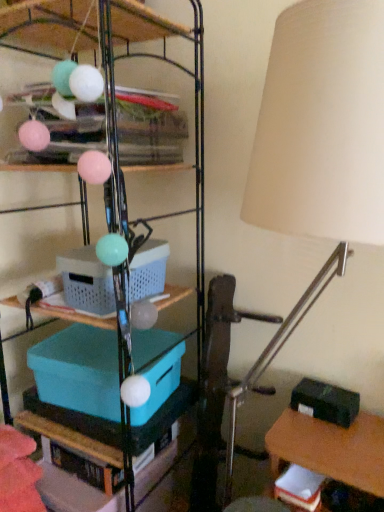
What do you see at coordinates (86, 282) in the screenshot? This screenshot has width=384, height=512. I see `plastic basket at center, acting as the first storage box starting from the top` at bounding box center [86, 282].

I want to click on teal plastic storage box at center-left, positioned as the second storage box in top-to-bottom order, so click(78, 371).

Image resolution: width=384 pixels, height=512 pixels. What do you see at coordinates (51, 24) in the screenshot? I see `metallic wire shelving at upper center, positioned as the second shelf in bottom-to-top order` at bounding box center [51, 24].

At what (x,y) coordinates should I click in order to perform the action: click on beige fabric lampshade at right. Please return your answer as a coordinate pair (x, y). Looking at the image, I should click on (318, 145).

From the image's perspective, which is below, teal plastic storage box at center-left, positioned as the second storage box in top-to-bottom order, or beige fabric lampshade at right?

teal plastic storage box at center-left, positioned as the second storage box in top-to-bottom order, is shown below in the image.

Is point (165, 331) more distant than point (286, 164)?

Yes, it is.

Could beige fabric lampshade at right be considered to be inside teal plastic storage box at center-left, which ranks as the third storage box in right-to-left order?

No, beige fabric lampshade at right is not inside teal plastic storage box at center-left, which ranks as the third storage box in right-to-left order.

Consider the image. From a real-world perspective, which object stands above the other?

beige fabric lampshade at right.

Is plastic basket at center, which appears as the 2th storage box when viewed from the left, in contact with metallic wire shelving at upper center, marked as the 1th shelf in a top-to-bottom arrangement?

No, plastic basket at center, which appears as the 2th storage box when viewed from the left, is not touching metallic wire shelving at upper center, marked as the 1th shelf in a top-to-bottom arrangement.

Based on the photo, relative to metallic wire shelving at upper center, positioned as the second shelf in bottom-to-top order, is plastic basket at center, placed as the 2th storage box when sorted from right to left, in front or behind?

In the image, plastic basket at center, placed as the 2th storage box when sorted from right to left, appears behind metallic wire shelving at upper center, positioned as the second shelf in bottom-to-top order.

From a real-world perspective, is plastic basket at center, arranged as the 3th storage box when ordered from the bottom, on metallic wire shelving at upper center, positioned as the second shelf in bottom-to-top order?

No.

Who is bigger, plastic basket at center, acting as the first storage box starting from the top, or metallic wire shelving at upper center, marked as the 1th shelf in a top-to-bottom arrangement?

Bigger between the two is metallic wire shelving at upper center, marked as the 1th shelf in a top-to-bottom arrangement.

Choose the correct answer: Is plastic basket at center, which appears as the 2th storage box when viewed from the left, inside teal plastic storage box at center-left, positioned as the second storage box in top-to-bottom order, or outside it?

plastic basket at center, which appears as the 2th storage box when viewed from the left, is not enclosed by teal plastic storage box at center-left, positioned as the second storage box in top-to-bottom order.

In the scene shown: Can you confirm if plastic basket at center, arranged as the 3th storage box when ordered from the bottom, is smaller than teal plastic storage box at center-left, which ranks as the second storage box in bottom-to-top order?

Yes.

From the image's perspective, is plastic basket at center, arranged as the 3th storage box when ordered from the bottom, under teal plastic storage box at center-left, which ranks as the third storage box in right-to-left order?

Incorrect, from the image's perspective, plastic basket at center, arranged as the 3th storage box when ordered from the bottom, is higher than teal plastic storage box at center-left, which ranks as the third storage box in right-to-left order.

Which of these two, plastic basket at center, acting as the first storage box starting from the top, or teal plastic storage box at center-left, which ranks as the third storage box in right-to-left order, is thinner?

plastic basket at center, acting as the first storage box starting from the top.

Between teal plastic storage bin at center, which is counted as the 2th shelf, starting from the top, and plastic basket at center, which appears as the 2th storage box when viewed from the left, which one has smaller size?

With smaller size is plastic basket at center, which appears as the 2th storage box when viewed from the left.

Which is correct: teal plastic storage bin at center, marked as the 1th shelf in a bottom-to-top arrangement, is inside plastic basket at center, arranged as the 3th storage box when ordered from the bottom, or outside of it?

teal plastic storage bin at center, marked as the 1th shelf in a bottom-to-top arrangement, is not inside plastic basket at center, arranged as the 3th storage box when ordered from the bottom, it's outside.

From the image's perspective, who appears lower, teal plastic storage bin at center, marked as the 1th shelf in a bottom-to-top arrangement, or plastic basket at center, which appears as the 2th storage box when viewed from the left?

From the image's view, teal plastic storage bin at center, marked as the 1th shelf in a bottom-to-top arrangement, is below.

Considering the relative sizes of teal plastic storage bin at center, which is counted as the 2th shelf, starting from the top, and plastic basket at center, arranged as the 3th storage box when ordered from the bottom, in the image provided, is teal plastic storage bin at center, which is counted as the 2th shelf, starting from the top, thinner than plastic basket at center, arranged as the 3th storage box when ordered from the bottom,?

No.

Can you confirm if teal plastic storage bin at center, which is counted as the 2th shelf, starting from the top, is positioned to the right of black matte storage box at lower right, the 3th storage box from the left?

Incorrect, teal plastic storage bin at center, which is counted as the 2th shelf, starting from the top, is not on the right side of black matte storage box at lower right, the 3th storage box from the left.

From a real-world perspective, is teal plastic storage bin at center, marked as the 1th shelf in a bottom-to-top arrangement, on top of black matte storage box at lower right, marked as the 1th storage box in a right-to-left arrangement?

Indeed, from a real-world perspective, teal plastic storage bin at center, marked as the 1th shelf in a bottom-to-top arrangement, stands above black matte storage box at lower right, marked as the 1th storage box in a right-to-left arrangement.

From the image's perspective, is teal plastic storage bin at center, marked as the 1th shelf in a bottom-to-top arrangement, above black matte storage box at lower right, positioned as the first storage box in bottom-to-top order?

Yes, from the image's perspective, teal plastic storage bin at center, marked as the 1th shelf in a bottom-to-top arrangement, is on top of black matte storage box at lower right, positioned as the first storage box in bottom-to-top order.

Is black matte storage box at lower right, positioned as the first storage box in bottom-to-top order, closer to camera compared to teal plastic storage bin at center, marked as the 1th shelf in a bottom-to-top arrangement?

No, black matte storage box at lower right, positioned as the first storage box in bottom-to-top order, is further to the viewer.

Is black matte storage box at lower right, marked as the 1th storage box in a right-to-left arrangement, directly adjacent to teal plastic storage bin at center, marked as the 1th shelf in a bottom-to-top arrangement?

black matte storage box at lower right, marked as the 1th storage box in a right-to-left arrangement, and teal plastic storage bin at center, marked as the 1th shelf in a bottom-to-top arrangement, are not in contact.

Would you say teal plastic storage bin at center, which is counted as the 2th shelf, starting from the top, is part of black matte storage box at lower right, the 3th storage box from the left,'s contents?

No, teal plastic storage bin at center, which is counted as the 2th shelf, starting from the top, is not surrounded by black matte storage box at lower right, the 3th storage box from the left.

Based on the photo, is plastic basket at center, which appears as the 2th storage box when viewed from the left, located outside beige fabric lampshade at right?

Yes.

Locate an element on the screen. the 1st storage box behind the beige fabric lampshade at right, counting from the anchor's position is located at coordinates click(x=86, y=282).

Is plastic basket at center, which appears as the 2th storage box when viewed from the left, looking in the opposite direction of beige fabric lampshade at right?

That's not correct — plastic basket at center, which appears as the 2th storage box when viewed from the left, is not looking away from beige fabric lampshade at right.

From the image's perspective, between plastic basket at center, arranged as the 3th storage box when ordered from the bottom, and beige fabric lampshade at right, which one is located above?

plastic basket at center, arranged as the 3th storage box when ordered from the bottom, from the image's perspective.

What are the coordinates of `the 2nd storage box to the left of the beige fabric lampshade at right, counting from the anchor's position` in the screenshot? It's located at (78, 371).

This screenshot has width=384, height=512. In order to click on shelf that is the 1st one when counting forward from the plastic basket at center, acting as the first storage box starting from the top in this screenshot , I will do `click(51, 24)`.

Estimate the real-world distances between objects in this image. Which object is closer to plastic basket at center, placed as the 2th storage box when sorted from right to left, beige fabric lampshade at right or black matte storage box at lower right, marked as the 1th storage box in a right-to-left arrangement?

Based on the image, beige fabric lampshade at right appears to be nearer to plastic basket at center, placed as the 2th storage box when sorted from right to left.

Based on their spatial positions, is teal plastic storage box at center-left, which ranks as the second storage box in bottom-to-top order, or beige fabric lampshade at right further from teal plastic storage bin at center, which is counted as the 2th shelf, starting from the top?

beige fabric lampshade at right lies further to teal plastic storage bin at center, which is counted as the 2th shelf, starting from the top, than the other object.

Which object lies further to the anchor point metallic wire shelving at upper center, marked as the 1th shelf in a top-to-bottom arrangement, plastic basket at center, arranged as the 3th storage box when ordered from the bottom, or black matte storage box at lower right, positioned as the first storage box in bottom-to-top order?

black matte storage box at lower right, positioned as the first storage box in bottom-to-top order, is positioned further to the anchor metallic wire shelving at upper center, marked as the 1th shelf in a top-to-bottom arrangement.

Considering their positions, is black matte storage box at lower right, the 3th storage box from the left, positioned further to teal plastic storage box at center-left, positioned as the second storage box in top-to-bottom order, than beige fabric lampshade at right?

beige fabric lampshade at right is further to teal plastic storage box at center-left, positioned as the second storage box in top-to-bottom order.

From the image, which object appears to be farther from teal plastic storage bin at center, which is counted as the 2th shelf, starting from the top, metallic wire shelving at upper center, marked as the 1th shelf in a top-to-bottom arrangement, or teal plastic storage box at center-left, positioned as the second storage box in top-to-bottom order?

Among the two, teal plastic storage box at center-left, positioned as the second storage box in top-to-bottom order, is located further to teal plastic storage bin at center, which is counted as the 2th shelf, starting from the top.

Estimate the real-world distances between objects in this image. Which object is further from teal plastic storage bin at center, which is counted as the 2th shelf, starting from the top, black matte storage box at lower right, which is counted as the third storage box, starting from the top, or metallic wire shelving at upper center, marked as the 1th shelf in a top-to-bottom arrangement?

Result: black matte storage box at lower right, which is counted as the third storage box, starting from the top.

Considering their positions, is teal plastic storage box at center-left, acting as the first storage box starting from the left, positioned closer to black matte storage box at lower right, which is counted as the third storage box, starting from the top, than beige fabric lampshade at right?

teal plastic storage box at center-left, acting as the first storage box starting from the left, lies closer to black matte storage box at lower right, which is counted as the third storage box, starting from the top, than the other object.

Based on the photo, looking at the image, which one is located further to teal plastic storage box at center-left, which ranks as the second storage box in bottom-to-top order, metallic wire shelving at upper center, marked as the 1th shelf in a top-to-bottom arrangement, or black matte storage box at lower right, which is counted as the third storage box, starting from the top?

metallic wire shelving at upper center, marked as the 1th shelf in a top-to-bottom arrangement, is further to teal plastic storage box at center-left, which ranks as the second storage box in bottom-to-top order.

At what (x,y) coordinates should I click in order to perform the action: click on storage box between teal plastic storage box at center-left, which ranks as the third storage box in right-to-left order, and black matte storage box at lower right, positioned as the first storage box in bottom-to-top order, in the horizontal direction. Please return your answer as a coordinate pair (x, y). Looking at the image, I should click on (86, 282).

The width and height of the screenshot is (384, 512). Identify the location of shelf between metallic wire shelving at upper center, positioned as the second shelf in bottom-to-top order, and teal plastic storage box at center-left, acting as the first storage box starting from the left, vertically. (114, 82).

The height and width of the screenshot is (512, 384). I want to click on lamp that lies between metallic wire shelving at upper center, positioned as the second shelf in bottom-to-top order, and teal plastic storage box at center-left, positioned as the second storage box in top-to-bottom order, from top to bottom, so click(x=318, y=145).

I want to click on storage box that lies between metallic wire shelving at upper center, positioned as the second shelf in bottom-to-top order, and beige fabric lampshade at right from top to bottom, so click(x=86, y=282).